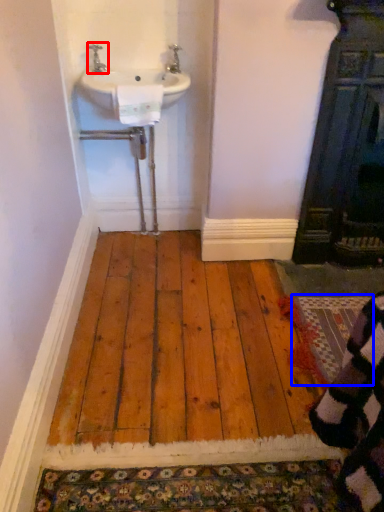
Question: Among these objects, which one is farthest to the camera, tap (highlighted by a red box) or doormat (highlighted by a blue box)?

Choices:
 (A) tap
 (B) doormat

Answer: (A)